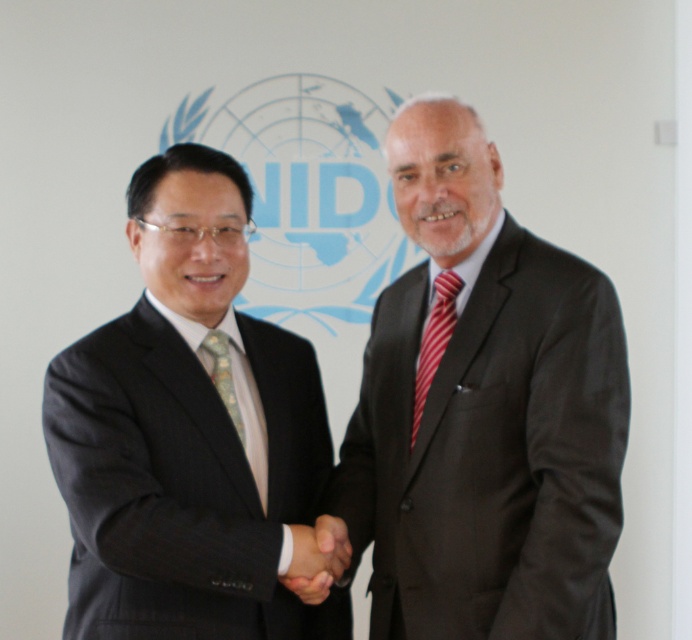
Question: Among these objects, which one is nearest to the camera?

Choices:
 (A) green textured tie at center
 (B) red striped tie at center
 (C) black textured suit at left

Answer: (C)

Question: Which point appears closest to the camera in this image?

Choices:
 (A) (291, 556)
 (B) (152, 346)

Answer: (A)

Question: Can you confirm if black textured suit at left is positioned above smooth black hand at center?

Choices:
 (A) no
 (B) yes

Answer: (B)

Question: Does red striped tie at center appear over green textured tie at center?

Choices:
 (A) no
 (B) yes

Answer: (B)

Question: Among these objects, which one is nearest to the camera?

Choices:
 (A) green textured tie at center
 (B) red striped tie at center

Answer: (A)

Question: Is black textured suit at left positioned behind smooth black hand at center?

Choices:
 (A) no
 (B) yes

Answer: (A)